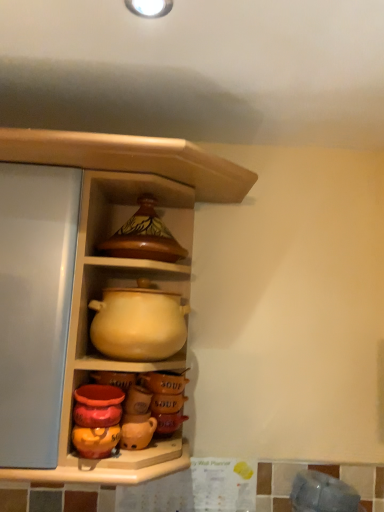
Where is `brown glossy pot at upper center`? The height and width of the screenshot is (512, 384). brown glossy pot at upper center is located at coordinates (124, 201).

What do you see at coordinates (122, 263) in the screenshot?
I see `matte ceramic pot at upper center` at bounding box center [122, 263].

Image resolution: width=384 pixels, height=512 pixels. Find the location of `brown glossy pot at upper center`. brown glossy pot at upper center is located at coordinates (124, 201).

From a real-world perspective, is matte ceramic pot at upper center located beneath matte yellow clay pot at center?

No, from a real-world perspective, matte ceramic pot at upper center is not under matte yellow clay pot at center.

I want to click on jug below the matte ceramic pot at upper center (from a real-world perspective), so click(x=139, y=323).

In terms of height, does matte ceramic pot at upper center look taller or shorter compared to matte yellow clay pot at center?

matte ceramic pot at upper center is taller than matte yellow clay pot at center.

Is matte ceramic pot at upper center wider or thinner than matte yellow clay pot at center?

Considering their sizes, matte ceramic pot at upper center looks broader than matte yellow clay pot at center.

In the image, is matte yellow clay pot at center positioned in front of or behind brown glossy pot at upper center?

matte yellow clay pot at center is in front of brown glossy pot at upper center.

Where is `cabinet above the matte yellow clay pot at center (from the image's perspective)`? This screenshot has height=512, width=384. cabinet above the matte yellow clay pot at center (from the image's perspective) is located at coordinates (124, 201).

Is point (108, 306) in front of point (157, 197)?

Yes.

How many degrees apart are the facing directions of matte yellow clay pot at center and brown glossy pot at upper center?

3.5 degrees.

In order to click on jug located on the left of matte ceramic pot at upper center in this screenshot , I will do `click(139, 323)`.

Would you consider matte yellow clay pot at center to be distant from matte ceramic pot at upper center?

matte yellow clay pot at center is actually quite close to matte ceramic pot at upper center.

From the image's perspective, is matte yellow clay pot at center on top of matte ceramic pot at upper center?

No.

Measure the distance between brown glossy pot at upper center and matte ceramic pot at upper center.

A distance of 3.71 inches exists between brown glossy pot at upper center and matte ceramic pot at upper center.

Can you confirm if brown glossy pot at upper center is positioned to the left of matte ceramic pot at upper center?

Indeed, brown glossy pot at upper center is positioned on the left side of matte ceramic pot at upper center.

Is brown glossy pot at upper center wider or thinner than matte ceramic pot at upper center?

Considering their sizes, brown glossy pot at upper center looks slimmer than matte ceramic pot at upper center.

I want to click on cabinet that appears above the matte ceramic pot at upper center (from a real-world perspective), so (x=124, y=201).

From a real-world perspective, is brown glossy pot at upper center on top of matte yellow clay pot at center?

Yes.

Considering the positions of points (172, 190) and (98, 346), is point (172, 190) closer to camera compared to point (98, 346)?

That is False.

Which object is thinner, brown glossy pot at upper center or matte yellow clay pot at center?

brown glossy pot at upper center.

From the image's perspective, who appears lower, brown glossy pot at upper center or matte yellow clay pot at center?

From the image's view, matte yellow clay pot at center is below.

Which is more to the right, matte ceramic pot at upper center or brown glossy pot at upper center?

From the viewer's perspective, matte ceramic pot at upper center appears more on the right side.

How different are the orientations of matte ceramic pot at upper center and brown glossy pot at upper center in degrees?

matte ceramic pot at upper center and brown glossy pot at upper center are facing 3.1 degrees away from each other.

Looking at this image, from a real-world perspective, who is located higher, matte ceramic pot at upper center or brown glossy pot at upper center?

brown glossy pot at upper center, from a real-world perspective.

Is matte ceramic pot at upper center positioned with its back to brown glossy pot at upper center?

Yes, matte ceramic pot at upper center is facing away from brown glossy pot at upper center.

At what (x,y) coordinates should I click in order to perform the action: click on shelf above the matte yellow clay pot at center (from a real-world perspective). Please return your answer as a coordinate pair (x, y). The image size is (384, 512). Looking at the image, I should click on (122, 263).

Where is `cabinet located behind the matte yellow clay pot at center`? cabinet located behind the matte yellow clay pot at center is located at coordinates (124, 201).

Based on their spatial positions, is matte ceramic pot at upper center or matte yellow clay pot at center further from brown glossy pot at upper center?

matte yellow clay pot at center is further to brown glossy pot at upper center.

Considering their positions, is brown glossy pot at upper center positioned further to matte ceramic pot at upper center than matte yellow clay pot at center?

Based on the image, matte yellow clay pot at center appears to be further to matte ceramic pot at upper center.

Estimate the real-world distances between objects in this image. Which object is closer to matte ceramic pot at upper center, matte yellow clay pot at center or brown glossy pot at upper center?

Among the two, brown glossy pot at upper center is located nearer to matte ceramic pot at upper center.

Looking at the image, which one is located closer to matte yellow clay pot at center, brown glossy pot at upper center or matte ceramic pot at upper center?

matte ceramic pot at upper center is closer to matte yellow clay pot at center.

Based on the photo, considering their positions, is matte ceramic pot at upper center positioned closer to matte yellow clay pot at center than brown glossy pot at upper center?

Based on the image, matte ceramic pot at upper center appears to be nearer to matte yellow clay pot at center.

Estimate the real-world distances between objects in this image. Which object is closer to brown glossy pot at upper center, matte yellow clay pot at center or matte ceramic pot at upper center?

The object closer to brown glossy pot at upper center is matte ceramic pot at upper center.

I want to click on shelf that lies between brown glossy pot at upper center and matte yellow clay pot at center from top to bottom, so click(x=122, y=263).